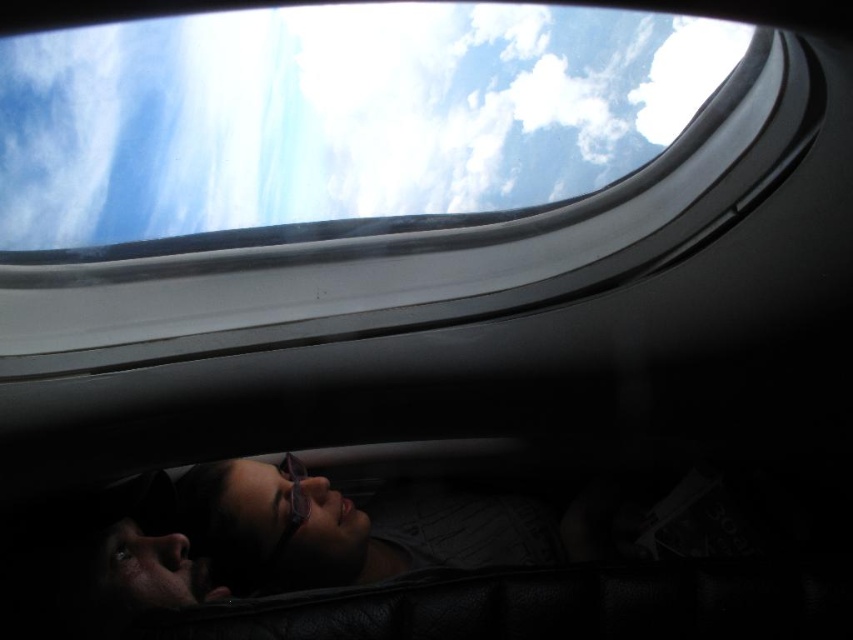
Which is in front, point (541, 104) or point (293, 516)?

Positioned in front is point (541, 104).

The height and width of the screenshot is (640, 853). What do you see at coordinates (335, 115) in the screenshot?
I see `white fluffy cloud at upper center` at bounding box center [335, 115].

I want to click on white fluffy cloud at upper center, so click(335, 115).